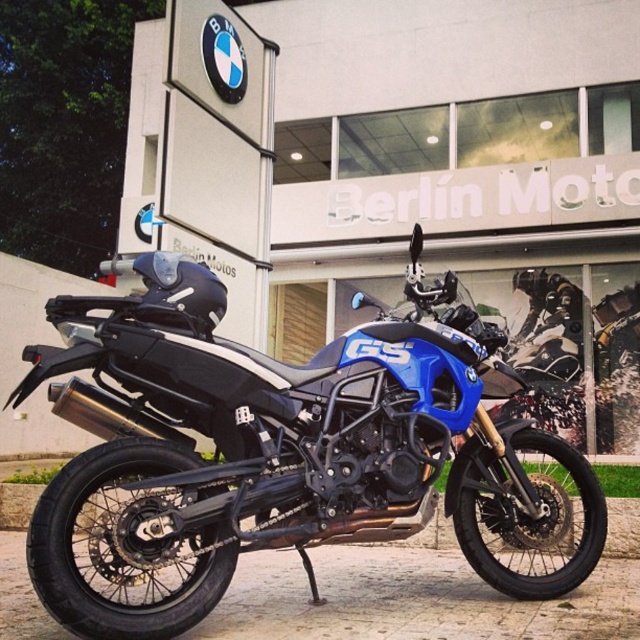
You are a delivery person who needs to place a large box between the blue matte motorcycle at center and the building labeled Berl n Moto. The box requires a space of 5 meters. Is there enough space between them?

The distance between the blue matte motorcycle at center and the building labeled Berl n Moto is 5.63 meters, which is more than enough to accommodate the 5 meter space required for the large box.